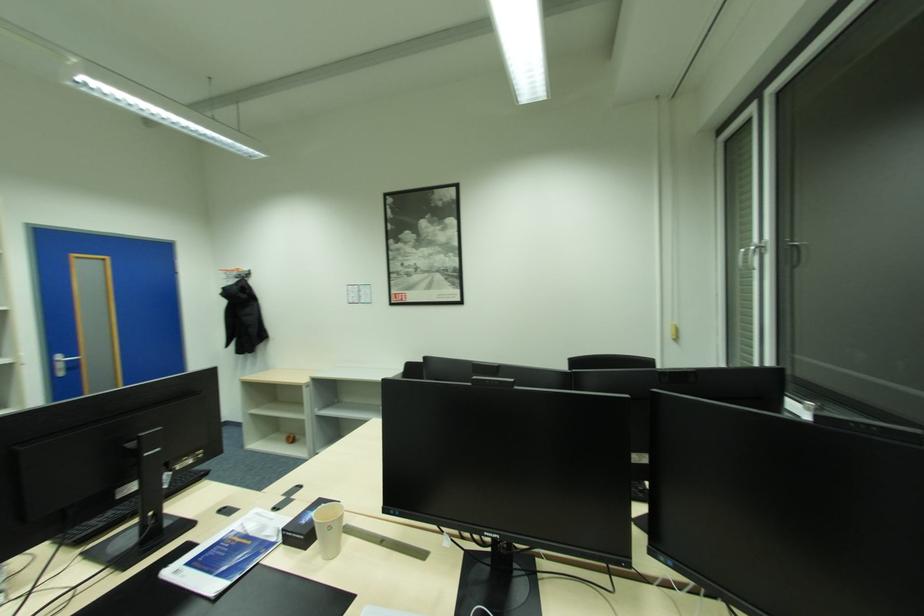
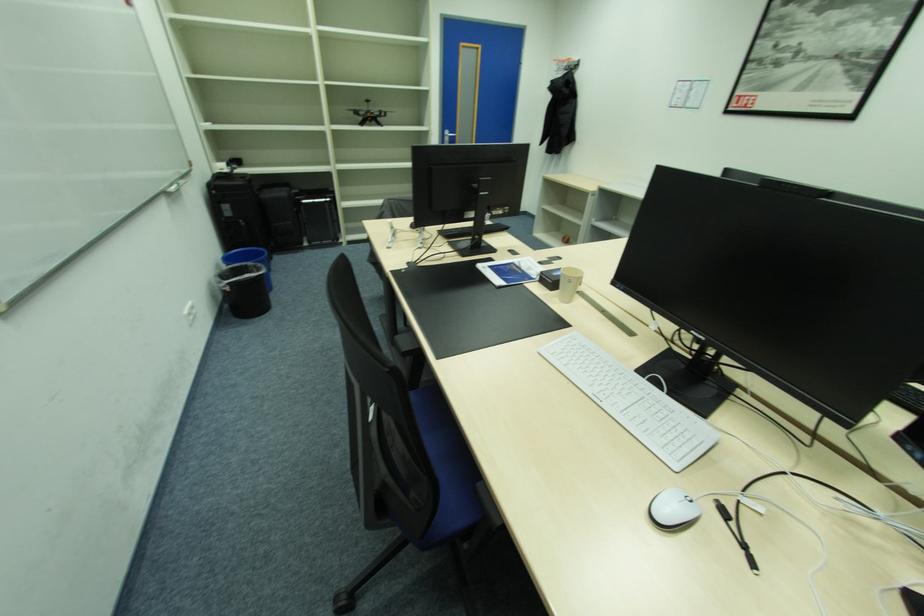
How did the camera likely rotate?

The rotation direction of the camera is left-down.